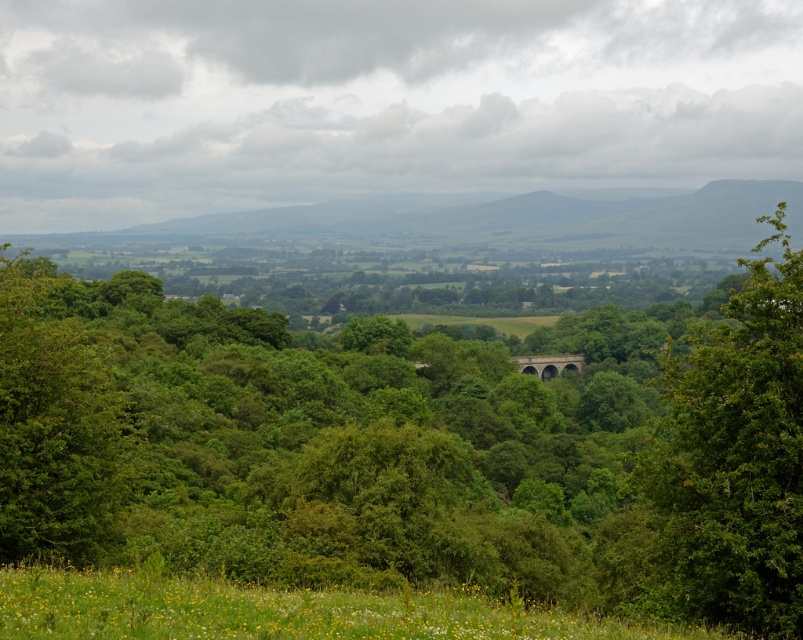
You are standing in the meadow and want to take a photo of both the green leafy tree at center and the green stone arch bridge at center. Which object should you focus on first to ensure both are in clear view?

You should focus on the green leafy tree at center first since it is closer to the viewer than the green stone arch bridge at center. By focusing on the closer object, both will be in clear view due to depth of field.

In the scene shown: You are a photographer planning to capture the green leafy tree at right and the green stone arch bridge at center in a single shot. Based on their heights, which object should you focus on first to ensure both are fully visible in the frame?

The green leafy tree at right is shorter than the green stone arch bridge at center, so you should focus on the green stone arch bridge at center first to ensure both are fully visible in the frame.